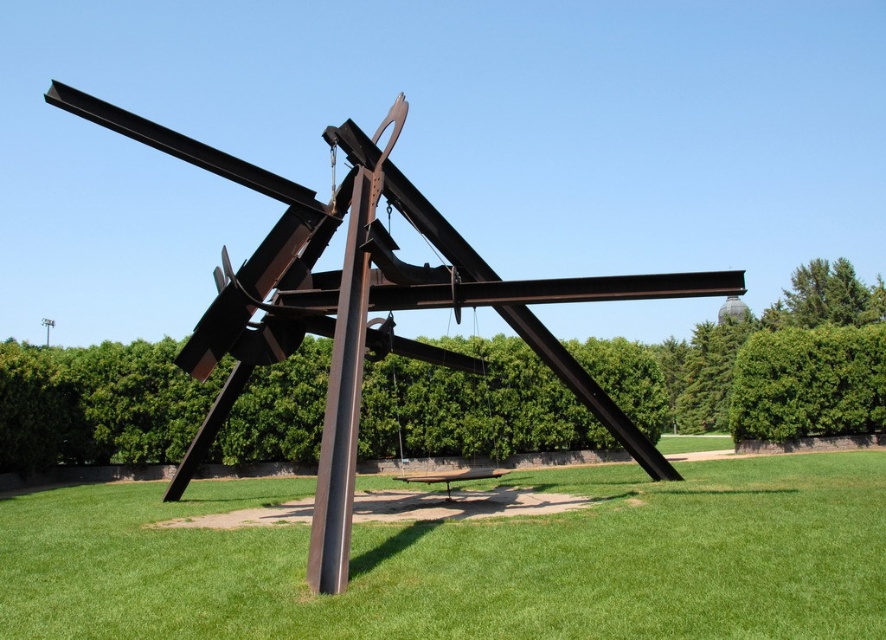
Question: Which point is farther to the camera?

Choices:
 (A) green grass at center
 (B) rustic metal sculpture at center

Answer: (B)

Question: Is green grass at center above rustic metal sculpture at center?

Choices:
 (A) yes
 (B) no

Answer: (B)

Question: Is green grass at center bigger than rustic metal sculpture at center?

Choices:
 (A) yes
 (B) no

Answer: (B)

Question: Does green grass at center appear on the left side of rustic metal sculpture at center?

Choices:
 (A) yes
 (B) no

Answer: (B)